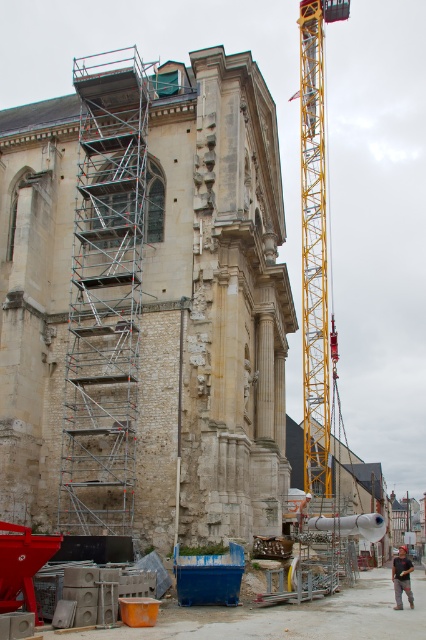
You are an engineer inspecting the construction site. You need to determine which object occupies more space in the scene. Which one is bigger between the silver metallic scaffolding at left and the yellow metallic crane at center?

The silver metallic scaffolding at left is larger in size than the yellow metallic crane at center, so the silver metallic scaffolding at left occupies more space in the scene.

You are a construction worker standing at the entrance of the site. You need to move a heavy beam to the yellow metallic crane at center. Which direction should you walk to reach the crane?

The yellow metallic crane at center is located at point 0.381 on the x and 0.739 on the y. Since you are at the entrance, you should walk towards the center of the site to reach the crane.

You are an architect visiting a construction site. You notice the silver metallic scaffolding at left and the dark gray shirt at center. Which object is larger in size?

The silver metallic scaffolding at left is bigger than the dark gray shirt at center.